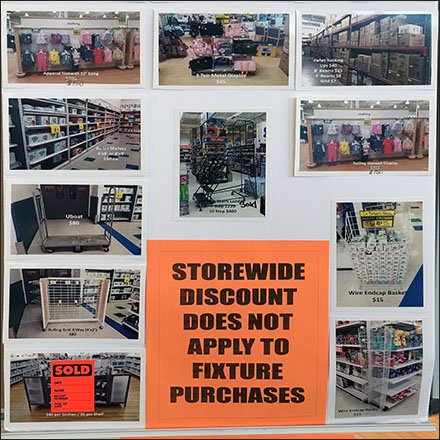
Locate an element on the screen. basket is located at coordinates (382, 254).